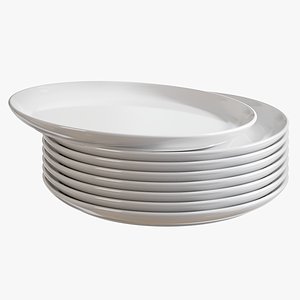
I want to click on plates, so click(152, 142), click(184, 157), click(184, 166), click(186, 176), click(189, 186), click(189, 194), click(190, 203), click(192, 217).